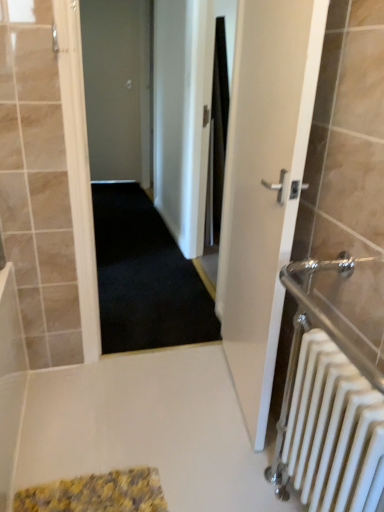
This screenshot has height=512, width=384. Describe the element at coordinates (264, 186) in the screenshot. I see `white glossy door at center right, placed as the 1th door when sorted from right to left` at that location.

How much space does white glossy door at center right, placed as the 1th door when sorted from right to left, occupy horizontally?

The width of white glossy door at center right, placed as the 1th door when sorted from right to left, is 6.13 inches.

In order to face black carpet at center, should I rotate leftwards or rightwards?

Turn left by 7.623 degrees to look at black carpet at center.

This screenshot has width=384, height=512. Identify the location of black carpet at center. (145, 277).

What is the approximate width of dark carpet at center?

It is 5.95 inches.

The width and height of the screenshot is (384, 512). I want to click on black fabric shower curtain at center, so click(217, 136).

Is point (269, 7) positioned before point (113, 68)?

That is True.

Where is `corridor above the white glossy door at center right, which appears as the 2th door when viewed from the left (from the image's perspective)`? Image resolution: width=384 pixels, height=512 pixels. corridor above the white glossy door at center right, which appears as the 2th door when viewed from the left (from the image's perspective) is located at coordinates (121, 187).

Which object is closer to the camera taking this photo, white glossy door at center right, arranged as the 2th door when viewed from the back, or dark carpet at center?

white glossy door at center right, arranged as the 2th door when viewed from the back, is more forward.

From the image's perspective, is dark carpet at center under black fabric shower curtain at center?

Yes, from the image's perspective, dark carpet at center is beneath black fabric shower curtain at center.

From a real-world perspective, who is located lower, dark carpet at center or black fabric shower curtain at center?

From a 3D spatial view, black fabric shower curtain at center is below.

How different are the orientations of dark carpet at center and black fabric shower curtain at center in degrees?

They differ by 0.247 degrees in their facing directions.

Who is shorter, dark carpet at center or black fabric shower curtain at center?

With less height is black fabric shower curtain at center.

Between point (304, 113) and point (218, 197), which one is positioned behind?

The point (218, 197) is behind.

Does white glossy door at center right, which appears as the 2th door when viewed from the left, appear on the right side of black fabric shower curtain at center?

Yes.

From the image's perspective, does white glossy door at center right, placed as the 1th door when sorted from right to left, appear lower than black fabric shower curtain at center?

Yes, from the image's perspective, white glossy door at center right, placed as the 1th door when sorted from right to left, is beneath black fabric shower curtain at center.

From a real-world perspective, does white glossy door at center right, which appears as the 2th door when viewed from the left, sit lower than black fabric shower curtain at center?

No, from a real-world perspective, white glossy door at center right, which appears as the 2th door when viewed from the left, is not under black fabric shower curtain at center.

Which is nearer, (110, 176) or (334, 422)?

Point (334, 422)

Consider the image. Who is bigger, matte gray door at center, the 2th door from the right, or white metallic radiator at right?

Bigger between the two is white metallic radiator at right.

Choose the correct answer: Is matte gray door at center, which ranks as the first door in top-to-bottom order, inside white metallic radiator at right or outside it?

matte gray door at center, which ranks as the first door in top-to-bottom order, is not enclosed by white metallic radiator at right.

From a real-world perspective, which object rests below the other?

black fabric shower curtain at center is physically lower.

Considering the positions of objects matte gray door at center, the 1th door in the back-to-front sequence, and black fabric shower curtain at center in the image provided, who is behind, matte gray door at center, the 1th door in the back-to-front sequence, or black fabric shower curtain at center?

matte gray door at center, the 1th door in the back-to-front sequence.

The width and height of the screenshot is (384, 512). Identify the location of door above the black fabric shower curtain at center (from the image's perspective). click(x=118, y=88).

At what (x,y) coordinates should I click in order to perform the action: click on door that is the 1st object above the black fabric shower curtain at center (from a real-world perspective). Please return your answer as a coordinate pair (x, y). The height and width of the screenshot is (512, 384). Looking at the image, I should click on (264, 186).

Looking at this image, which is correct: black fabric shower curtain at center is inside white glossy door at center right, which appears as the 2th door when viewed from the left, or outside of it?

black fabric shower curtain at center is not inside white glossy door at center right, which appears as the 2th door when viewed from the left, it's outside.

Would you consider black fabric shower curtain at center to be distant from white glossy door at center right, which appears as the 2th door when viewed from the left?

Yes, black fabric shower curtain at center is far from white glossy door at center right, which appears as the 2th door when viewed from the left.

Is white glossy door at center right, arranged as the 2th door when viewed from the back, inside the boundaries of matte gray door at center, the second door when ordered from bottom to top, or outside?

The correct answer is: outside.

Between white glossy door at center right, which is the 1th door from front to back, and matte gray door at center, the second door when ordered from bottom to top, which one has larger width?

Wider between the two is white glossy door at center right, which is the 1th door from front to back.

Is white glossy door at center right, which is the 1th door in bottom-to-top order, in front of or behind matte gray door at center, which appears as the 1th door when viewed from the left, in the image?

white glossy door at center right, which is the 1th door in bottom-to-top order, is positioned closer to the viewer than matte gray door at center, which appears as the 1th door when viewed from the left.

This screenshot has height=512, width=384. What are the coordinates of `door below the dark carpet at center (from a real-world perspective)` in the screenshot? It's located at (264, 186).

The height and width of the screenshot is (512, 384). In the image, there is a dark carpet at center. What are the coordinates of `shower curtain above it (from the image's perspective)` in the screenshot? It's located at (217, 136).

From the image, which object appears to be nearer to dark carpet at center, black carpet at center or black fabric shower curtain at center?

black carpet at center is positioned closer to the anchor dark carpet at center.

Based on the photo, looking at the image, which one is located closer to matte gray door at center, the 1th door in the back-to-front sequence, black carpet at center or white metallic radiator at right?

black carpet at center lies closer to matte gray door at center, the 1th door in the back-to-front sequence, than the other object.

Considering their positions, is matte gray door at center, which appears as the 1th door when viewed from the left, positioned closer to black carpet at center than dark carpet at center?

dark carpet at center is positioned closer to the anchor black carpet at center.

Which object lies further to the anchor point black carpet at center, matte gray door at center, which ranks as the first door in top-to-bottom order, or white glossy door at center right, which appears as the 2th door when viewed from the left?

matte gray door at center, which ranks as the first door in top-to-bottom order, lies further to black carpet at center than the other object.

Considering their positions, is dark carpet at center positioned further to matte gray door at center, the second door when ordered from bottom to top, than black fabric shower curtain at center?

Among the two, black fabric shower curtain at center is located further to matte gray door at center, the second door when ordered from bottom to top.

Consider the image. Estimate the real-world distances between objects in this image. Which object is further from dark carpet at center, white metallic radiator at right or white glossy door at center right, the 2th door viewed from the top?

white metallic radiator at right.

From the image, which object appears to be farther from matte gray door at center, the second door when ordered from bottom to top, black carpet at center or white glossy door at center right, which is the 1th door from front to back?

Based on the image, white glossy door at center right, which is the 1th door from front to back, appears to be further to matte gray door at center, the second door when ordered from bottom to top.

From the image, which object appears to be nearer to black fabric shower curtain at center, white metallic radiator at right or black carpet at center?

black carpet at center lies closer to black fabric shower curtain at center than the other object.

The height and width of the screenshot is (512, 384). Identify the location of doormat between dark carpet at center and matte gray door at center, which appears as the 1th door when viewed from the left, from front to back. (145, 277).

This screenshot has height=512, width=384. I want to click on doormat between white glossy door at center right, which is the 1th door from front to back, and matte gray door at center, the second door when ordered from bottom to top, in the front-back direction, so click(145, 277).

This screenshot has width=384, height=512. Find the location of `corridor between white metallic radiator at right and black carpet at center from front to back`. corridor between white metallic radiator at right and black carpet at center from front to back is located at coordinates (121, 187).

This screenshot has width=384, height=512. What are the coordinates of `shower curtain positioned between dark carpet at center and matte gray door at center, the second door when ordered from bottom to top, from near to far` in the screenshot? It's located at (217, 136).